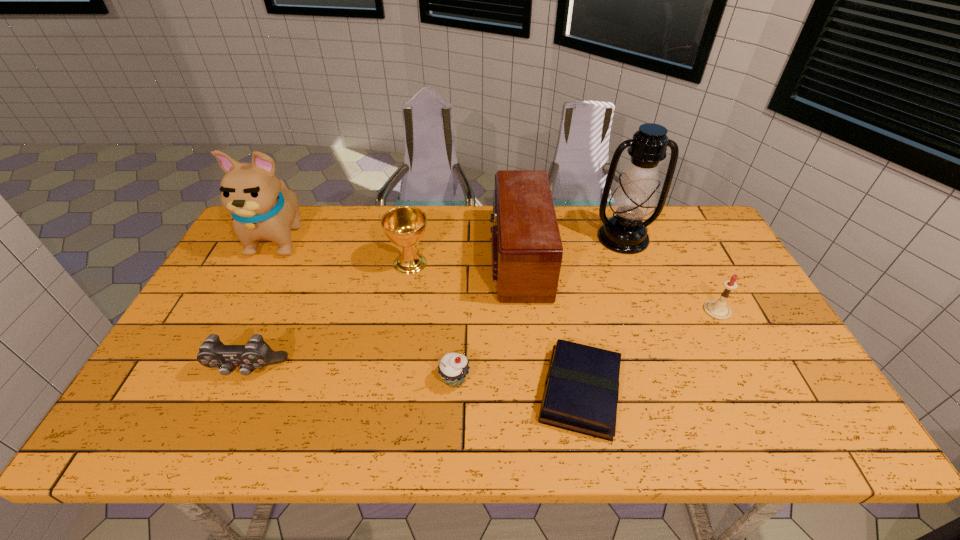
Where is `oil lamp`? The height and width of the screenshot is (540, 960). oil lamp is located at coordinates (634, 198).

I want to click on puppy, so click(262, 206).

I want to click on radio receiver, so click(x=527, y=251).

Locate an element on the screen. the sixth object from right to left is located at coordinates (405, 226).

The height and width of the screenshot is (540, 960). Identify the location of chalice. click(405, 226).

The width and height of the screenshot is (960, 540). In order to click on candle in this screenshot , I will do `click(718, 309)`.

Where is `control`? This screenshot has width=960, height=540. control is located at coordinates (256, 353).

Where is `cupcake`? cupcake is located at coordinates (453, 368).

Locate an element on the screen. This screenshot has height=540, width=960. the shortest object is located at coordinates (581, 391).

Locate an element on the screen. free space located on the front of the seventh object from left to right is located at coordinates (648, 306).